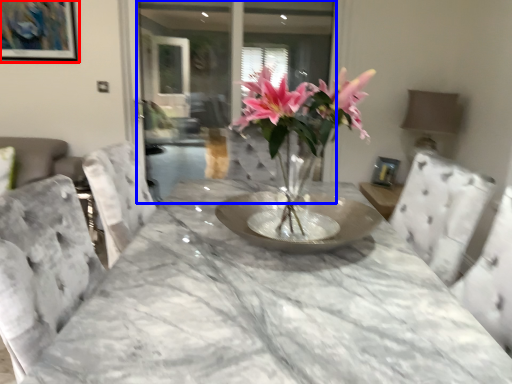
Question: Among these objects, which one is nearest to the camera, picture frame (highlighted by a red box) or glass door (highlighted by a blue box)?

Choices:
 (A) picture frame
 (B) glass door

Answer: (A)